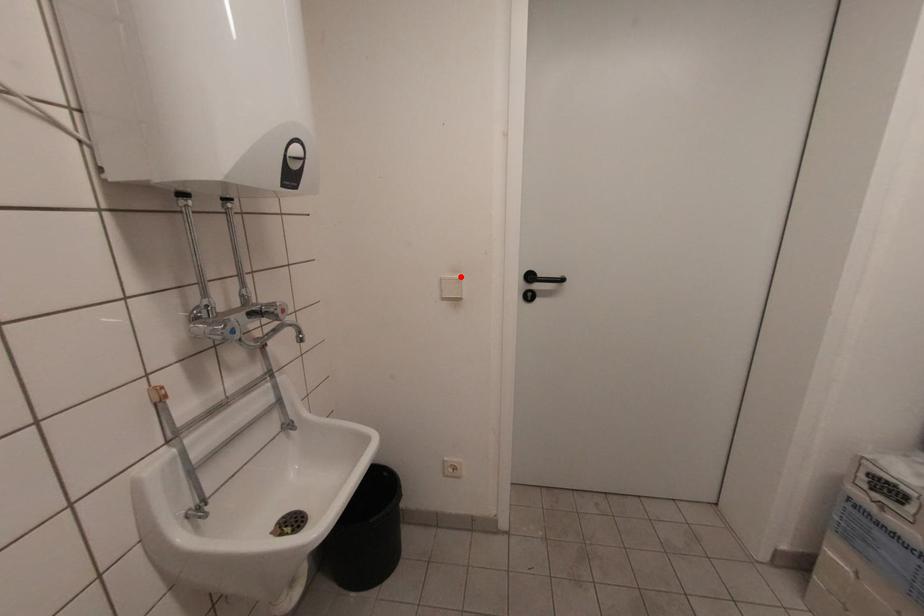
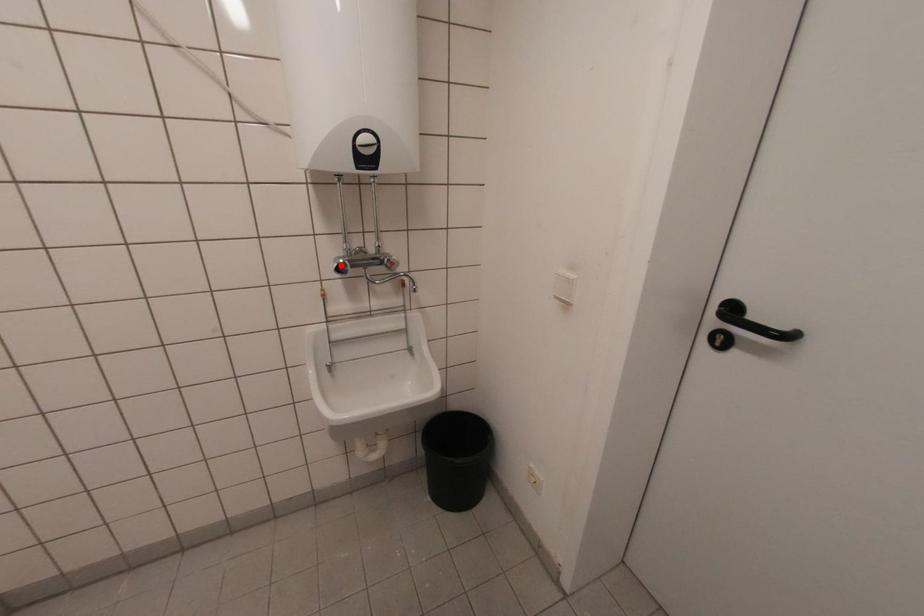
I am providing you with two images of the same scene from different viewpoints. A red point is marked on the first image and another point is marked on the second image. Is the red point in image1 aligned with the point shown in image2?

No